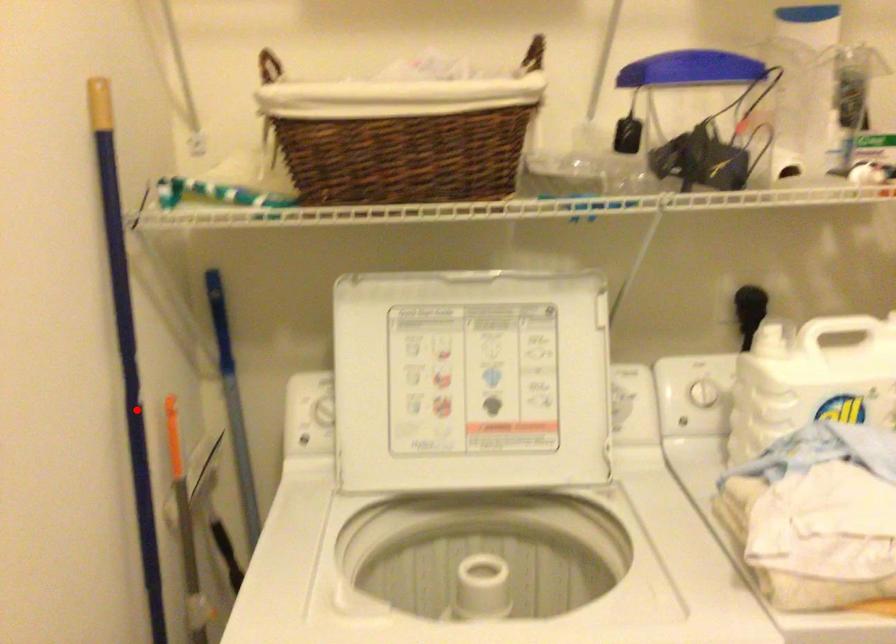
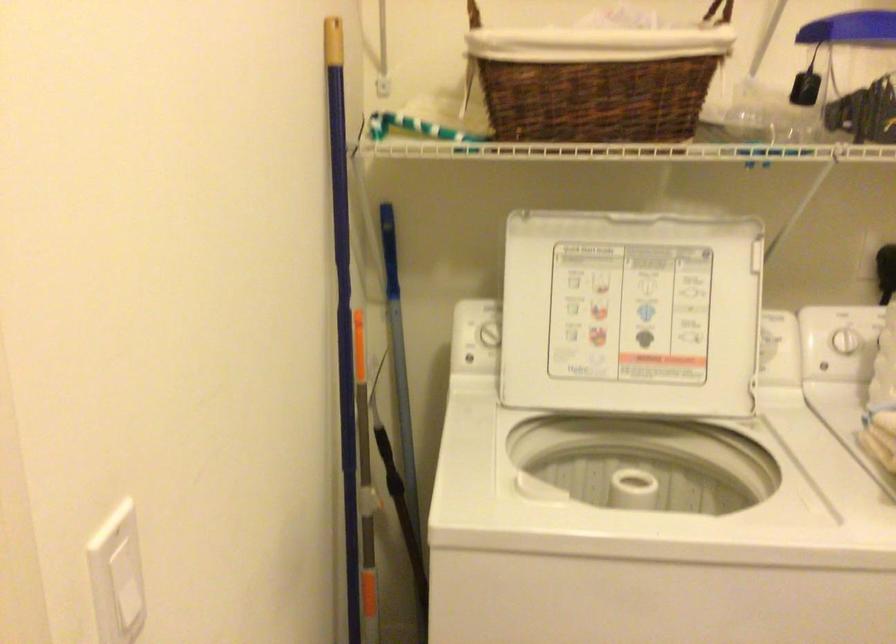
Question: I am providing you with two images of the same scene from different viewpoints. Given a red point in image1, look at the same physical point in image2. Is it:

Choices:
 (A) Closer to the viewpoint
 (B) Farther from the viewpoint

Answer: (B)